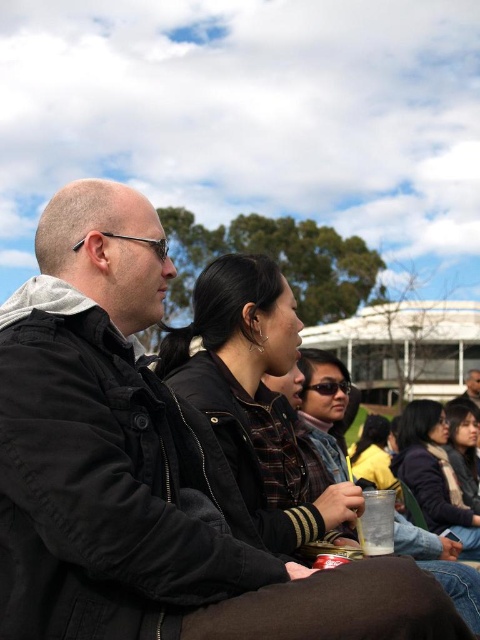
You are a photographer trying to capture a group photo of the black matte jacket at left and the matte black jacket at lower right. Given that your camera has a maximum focus range of 30 meters, will you be able to take a clear photo of both subjects simultaneously?

The distance between the black matte jacket at left and matte black jacket at lower right is 38.76 meters, which exceeds the camera maximum focus range of 30 meters. Therefore, you cannot take a clear photo of both subjects simultaneously.

You are a photographer trying to capture a closeup of the dark brown hair at lower right and the matte black jacket at lower right in the scene. Since you want both to be clearly visible, which object should you focus on to ensure the wider subject is in sharp focus?

The dark brown hair at lower right has a greater width than the matte black jacket at lower right, so focusing on the dark brown hair at lower right will ensure the wider subject is in sharp focus.